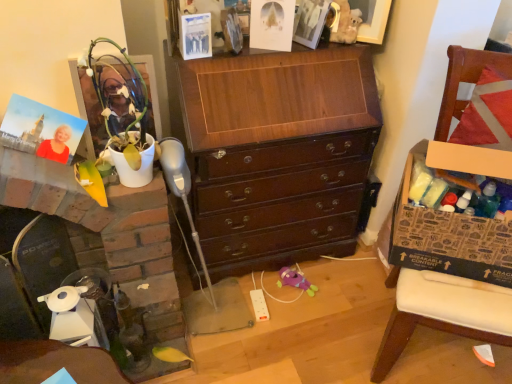
Question: Can you confirm if shiny dark wood chest of drawers at center is shorter than white glossy fireplace at left?

Choices:
 (A) no
 (B) yes

Answer: (A)

Question: Can you confirm if shiny dark wood chest of drawers at center is smaller than white glossy fireplace at left?

Choices:
 (A) yes
 (B) no

Answer: (A)

Question: From a real-world perspective, does shiny dark wood chest of drawers at center sit lower than white glossy fireplace at left?

Choices:
 (A) yes
 (B) no

Answer: (B)

Question: Would you consider shiny dark wood chest of drawers at center to be distant from white glossy fireplace at left?

Choices:
 (A) no
 (B) yes

Answer: (A)

Question: Considering the relative positions of shiny dark wood chest of drawers at center and white glossy fireplace at left in the image provided, is shiny dark wood chest of drawers at center to the right of white glossy fireplace at left from the viewer's perspective?

Choices:
 (A) yes
 (B) no

Answer: (A)

Question: From their relative heights in the image, would you say brown cardboard box at right is taller or shorter than shiny dark wood chest of drawers at center?

Choices:
 (A) tall
 (B) short

Answer: (B)

Question: Is point (509, 175) closer or farther from the camera than point (348, 193)?

Choices:
 (A) farther
 (B) closer

Answer: (B)

Question: Is brown cardboard box at right to the left or to the right of shiny dark wood chest of drawers at center in the image?

Choices:
 (A) right
 (B) left

Answer: (A)

Question: From the image's perspective, is brown cardboard box at right above or below shiny dark wood chest of drawers at center?

Choices:
 (A) above
 (B) below

Answer: (B)

Question: Considering the positions of brown cardboard box at right and matte white picture frame at upper center, which is counted as the 1th picture frame, starting from the back, in the image, is brown cardboard box at right wider or thinner than matte white picture frame at upper center, which is counted as the 1th picture frame, starting from the back,?

Choices:
 (A) thin
 (B) wide

Answer: (B)

Question: In terms of height, does brown cardboard box at right look taller or shorter compared to matte white picture frame at upper center, which is counted as the 1th picture frame, starting from the back?

Choices:
 (A) tall
 (B) short

Answer: (A)

Question: Is brown cardboard box at right to the left or to the right of matte white picture frame at upper center, which is counted as the 1th picture frame, starting from the back, in the image?

Choices:
 (A) right
 (B) left

Answer: (A)

Question: In the image, is brown cardboard box at right positioned in front of or behind matte white picture frame at upper center, arranged as the 2th picture frame when viewed from the left?

Choices:
 (A) behind
 (B) front

Answer: (B)

Question: Considering the positions of white glossy fireplace at left and matte white picture frame at upper center, arranged as the 2th picture frame when viewed from the left, in the image, is white glossy fireplace at left wider or thinner than matte white picture frame at upper center, arranged as the 2th picture frame when viewed from the left,?

Choices:
 (A) thin
 (B) wide

Answer: (B)

Question: Is white glossy fireplace at left in front of or behind matte white picture frame at upper center, arranged as the 2th picture frame when viewed from the left, in the image?

Choices:
 (A) front
 (B) behind

Answer: (A)